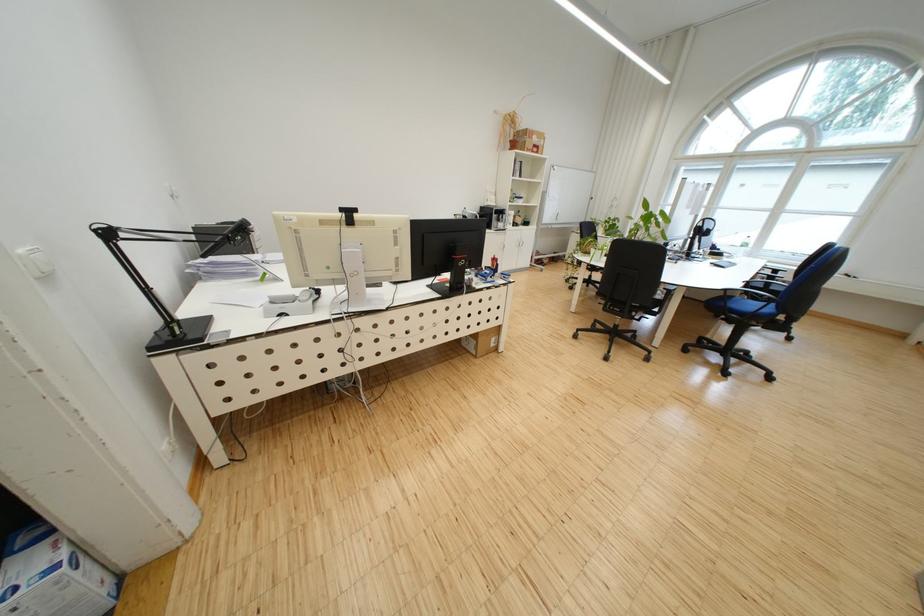
I want to click on white light switch, so click(x=39, y=265).